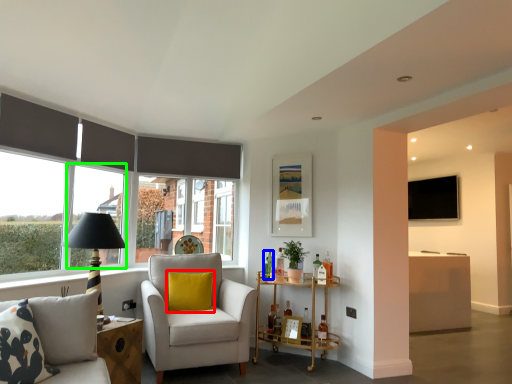
Question: Which is farther away from pillow (highlighted by a red box)? bottle (highlighted by a blue box) or window (highlighted by a green box)?

Choices:
 (A) bottle
 (B) window

Answer: (B)